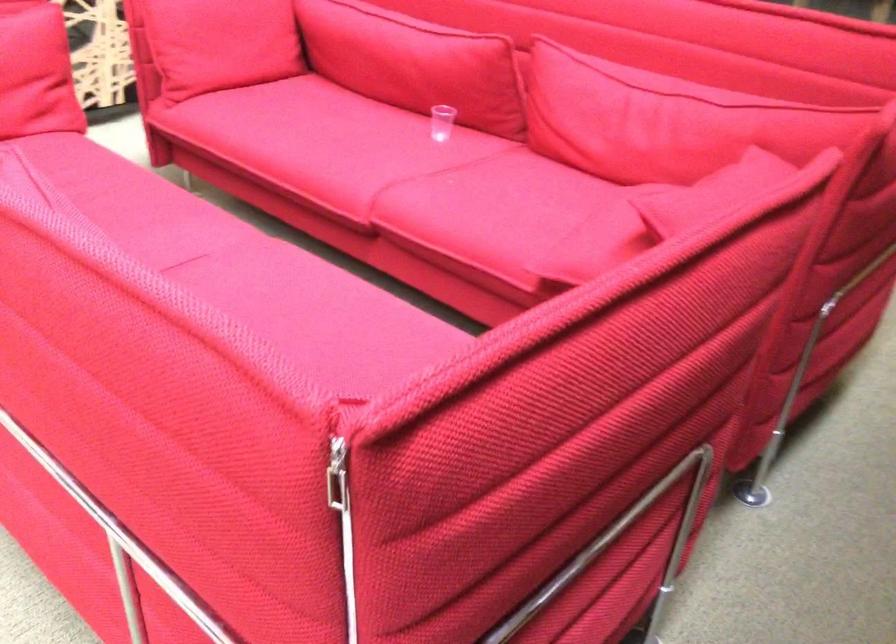
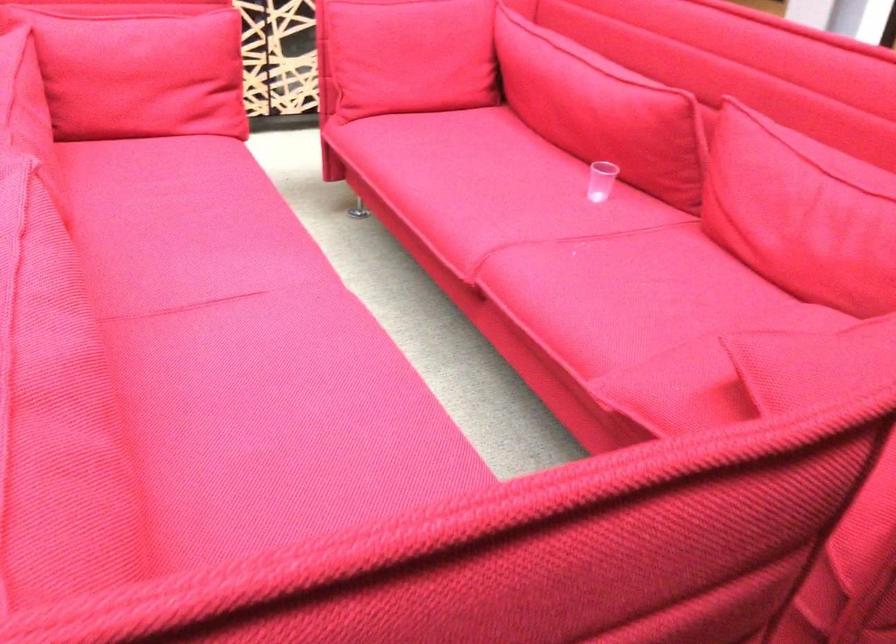
Find the pixel in the second image that matches (x=433, y=122) in the first image.

(600, 180)